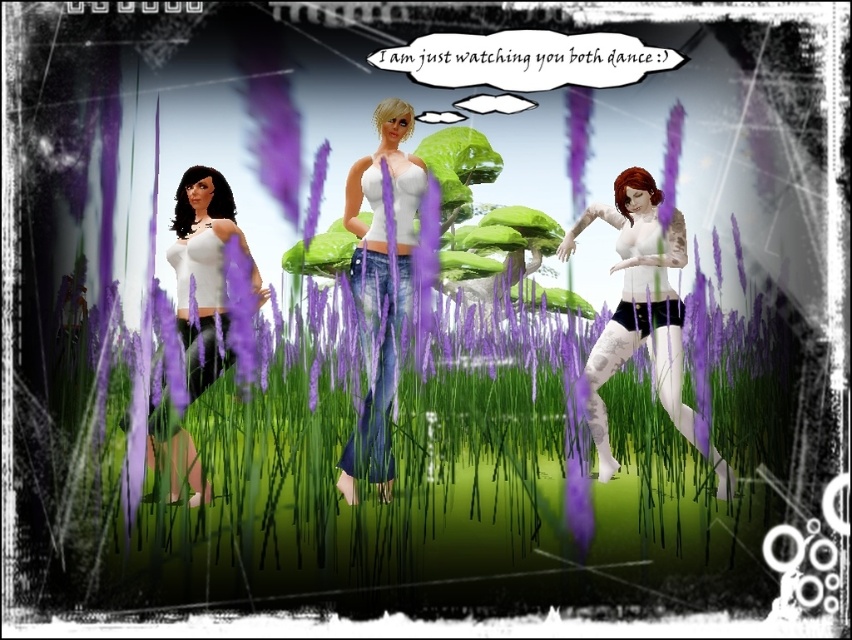
Is white matte leggings at center above matte purple lavender at upper center?

No, white matte leggings at center is not above matte purple lavender at upper center.

What do you see at coordinates (639, 305) in the screenshot? I see `white matte leggings at center` at bounding box center [639, 305].

The image size is (852, 640). What are the coordinates of `white matte leggings at center` in the screenshot? It's located at (639, 305).

Does matte white tank top at left lie behind white matte dress at left?

No, it is not.

Where is `matte white tank top at left`? matte white tank top at left is located at coordinates (205, 272).

This screenshot has width=852, height=640. In order to click on matte white tank top at left in this screenshot , I will do `click(205, 272)`.

Find the location of a particular element. The height and width of the screenshot is (640, 852). matte white tank top at left is located at coordinates click(205, 272).

Does purple grass at center have a greater height compared to matte purple lavender at upper center?

Incorrect, purple grass at center's height is not larger of matte purple lavender at upper center's.

Looking at this image, who is more forward, (210,516) or (568,90)?

Point (210,516)

Describe the element at coordinates (429, 497) in the screenshot. The image size is (852, 640). I see `purple grass at center` at that location.

Where is `purple grass at center`? The image size is (852, 640). purple grass at center is located at coordinates (429, 497).